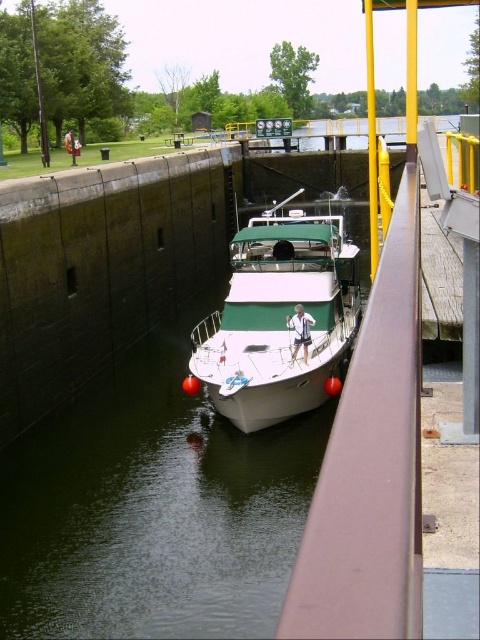
Does white glossy water at center have a lesser height compared to white glossy boat at center?

Correct, white glossy water at center is not as tall as white glossy boat at center.

Does white glossy water at center have a greater height compared to white glossy boat at center?

No.

I want to click on white glossy water at center, so click(152, 508).